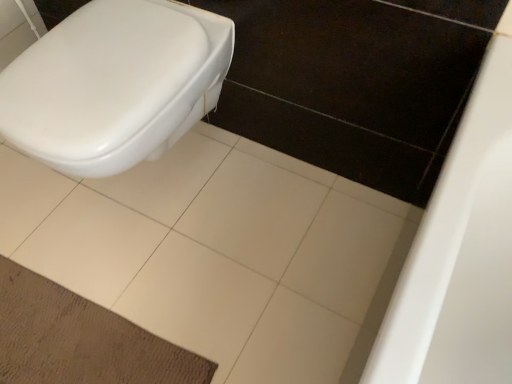
Question: Is white ceramic tile at center inside the boundaries of brown textured mat at lower left, or outside?

Choices:
 (A) outside
 (B) inside

Answer: (A)

Question: From a real-world perspective, relative to brown textured mat at lower left, is white ceramic tile at center vertically above or below?

Choices:
 (A) above
 (B) below

Answer: (B)

Question: Which object is positioned farthest from the brown textured mat at lower left?

Choices:
 (A) white glossy toilet at left
 (B) white ceramic tile at center

Answer: (A)

Question: Based on their relative distances, which object is nearer to the brown textured mat at lower left?

Choices:
 (A) white glossy toilet at left
 (B) white ceramic tile at center

Answer: (B)